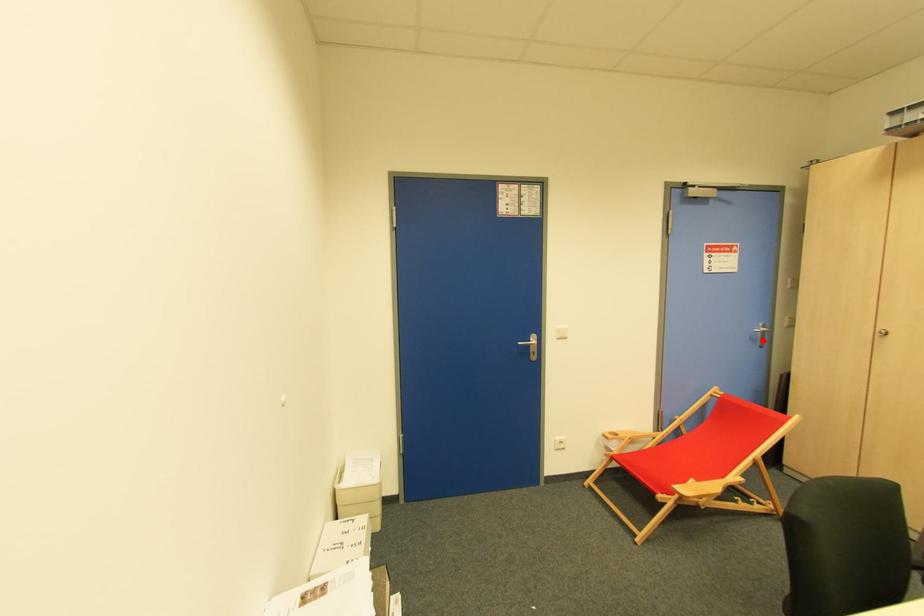
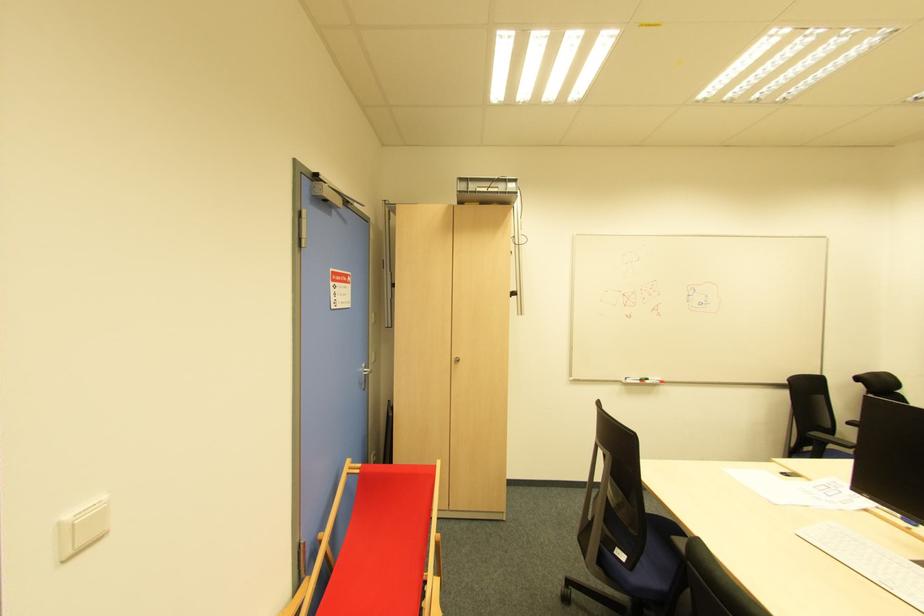
The point at the highlighted location is marked in the first image. Where is the corresponding point in the second image?

(366, 382)